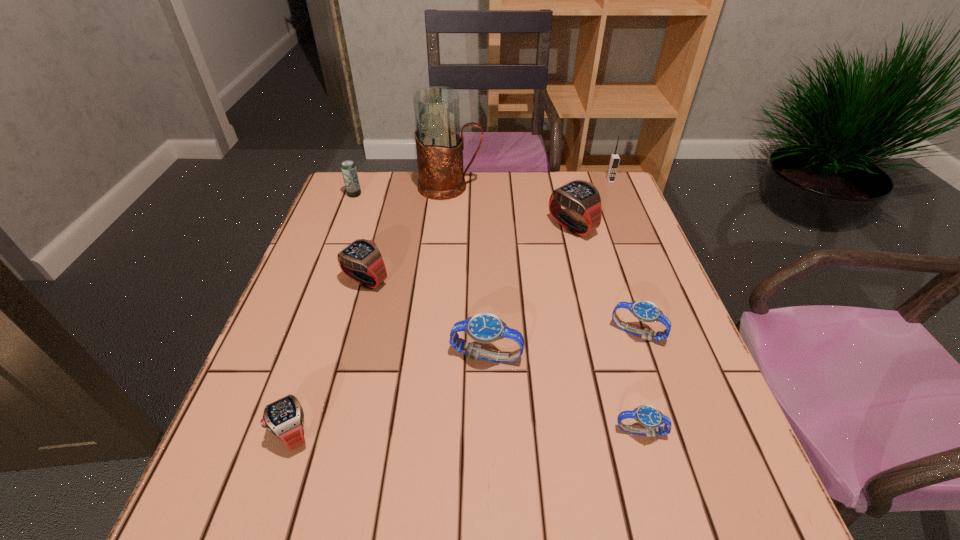
At what (x,y) coordinates should I click in order to perform the action: click on gray pitcher. Please return your answer as a coordinate pair (x, y). Looking at the image, I should click on pos(439,146).

Identify the location of pitcher. (439, 146).

Where is `the rightmost object`? The width and height of the screenshot is (960, 540). the rightmost object is located at coordinates (614, 159).

Where is `the farthest red watch`? The height and width of the screenshot is (540, 960). the farthest red watch is located at coordinates (579, 196).

At what (x,y) coordinates should I click in order to perform the action: click on the rightmost red watch. Please return your answer as a coordinate pair (x, y). This screenshot has height=540, width=960. Looking at the image, I should click on (579, 196).

Where is `beer can`? This screenshot has width=960, height=540. beer can is located at coordinates (348, 168).

Locate an element on the screen. The height and width of the screenshot is (540, 960). the second farthest red watch is located at coordinates (361, 260).

Find the location of a particular element. the second biggest red watch is located at coordinates (361, 260).

Locate an element on the screen. the leftmost blue watch is located at coordinates (485, 327).

Locate an element on the screen. Image resolution: width=960 pixels, height=540 pixels. the biggest blue watch is located at coordinates (485, 327).